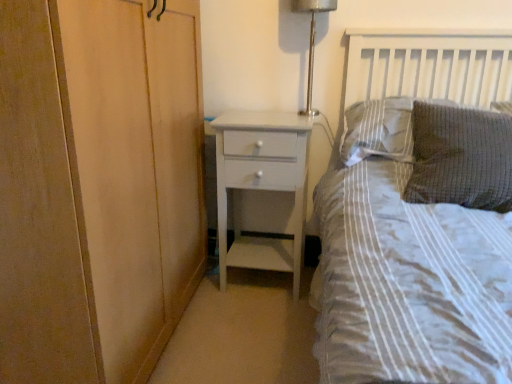
Question: Does gray textured pillow at upper right, which is the first pillow from back to front, have a greater width compared to metallic silver lamp at upper right?

Choices:
 (A) yes
 (B) no

Answer: (A)

Question: Is gray textured pillow at upper right, marked as the 2th pillow in a front-to-back arrangement, thinner than metallic silver lamp at upper right?

Choices:
 (A) yes
 (B) no

Answer: (B)

Question: From the image's perspective, is gray textured pillow at upper right, which is the first pillow from back to front, under metallic silver lamp at upper right?

Choices:
 (A) yes
 (B) no

Answer: (A)

Question: From a real-world perspective, is gray textured pillow at upper right, which is the first pillow from back to front, under metallic silver lamp at upper right?

Choices:
 (A) yes
 (B) no

Answer: (A)

Question: Can you confirm if gray textured pillow at upper right, which is the first pillow from back to front, is shorter than metallic silver lamp at upper right?

Choices:
 (A) no
 (B) yes

Answer: (B)

Question: Considering the relative positions of gray textured pillow at upper right, which is the first pillow from back to front, and metallic silver lamp at upper right in the image provided, is gray textured pillow at upper right, which is the first pillow from back to front, to the left of metallic silver lamp at upper right from the viewer's perspective?

Choices:
 (A) yes
 (B) no

Answer: (B)

Question: Does white painted wood chest of drawers at center have a larger size compared to gray textured pillow at upper right, which is the first pillow from back to front?

Choices:
 (A) no
 (B) yes

Answer: (B)

Question: From a real-world perspective, is white painted wood chest of drawers at center located beneath gray textured pillow at upper right, which is the first pillow from back to front?

Choices:
 (A) yes
 (B) no

Answer: (A)

Question: Can you confirm if white painted wood chest of drawers at center is thinner than gray textured pillow at upper right, marked as the 2th pillow in a front-to-back arrangement?

Choices:
 (A) yes
 (B) no

Answer: (B)

Question: Can you confirm if white painted wood chest of drawers at center is wider than gray textured pillow at upper right, marked as the 2th pillow in a front-to-back arrangement?

Choices:
 (A) yes
 (B) no

Answer: (A)

Question: From a real-world perspective, does white painted wood chest of drawers at center stand above gray textured pillow at upper right, which is the first pillow from back to front?

Choices:
 (A) no
 (B) yes

Answer: (A)

Question: Is white painted wood chest of drawers at center positioned behind gray textured pillow at upper right, marked as the 2th pillow in a front-to-back arrangement?

Choices:
 (A) yes
 (B) no

Answer: (A)

Question: From a real-world perspective, is textured gray pillow at upper right, which is the first pillow in front-to-back order, positioned under white painted wood chest of drawers at center based on gravity?

Choices:
 (A) no
 (B) yes

Answer: (A)